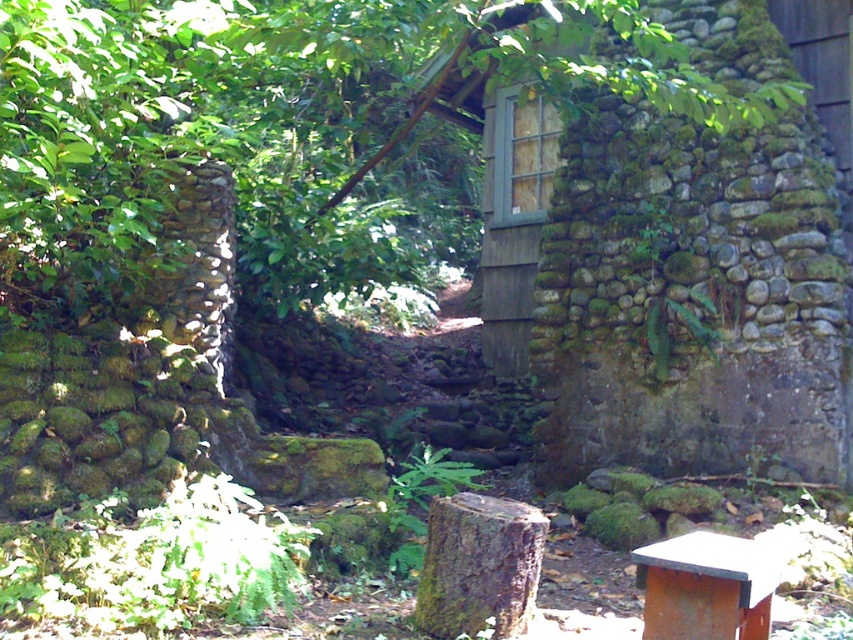
Question: Does mossy bark stump at center have a greater width compared to rusty metal beehive at lower right?

Choices:
 (A) yes
 (B) no

Answer: (A)

Question: Does mossy bark stump at center have a greater width compared to rusty metal beehive at lower right?

Choices:
 (A) no
 (B) yes

Answer: (B)

Question: Is mossy bark stump at center bigger than rusty metal beehive at lower right?

Choices:
 (A) yes
 (B) no

Answer: (A)

Question: Which object is closer to the camera taking this photo?

Choices:
 (A) rusty metal beehive at lower right
 (B) mossy bark stump at center

Answer: (A)

Question: Which point is farther to the camera?

Choices:
 (A) (518, 522)
 (B) (751, 557)

Answer: (A)